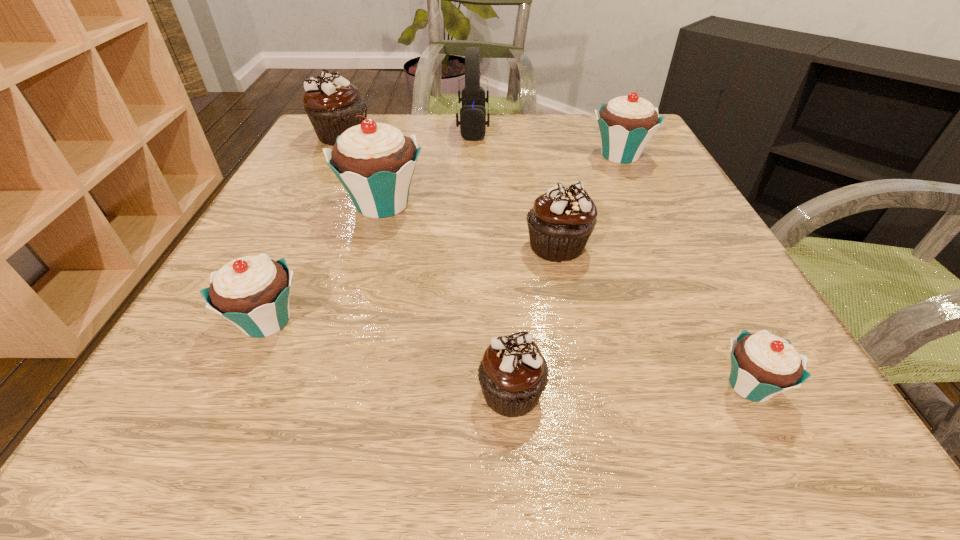
Find the location of a particular element. The height and width of the screenshot is (540, 960). object situated at the far left corner is located at coordinates (331, 103).

In order to click on object located in the far right corner section of the desktop in this screenshot , I will do `click(626, 124)`.

Locate an element on the screen. The image size is (960, 540). object that is positioned at the near right corner is located at coordinates (763, 365).

The width and height of the screenshot is (960, 540). Find the location of `free space at the far edge`. free space at the far edge is located at coordinates (511, 117).

Identify the location of vacant area at the near edge. The width and height of the screenshot is (960, 540). (425, 424).

The height and width of the screenshot is (540, 960). What are the coordinates of `free space at the left edge` in the screenshot? It's located at (333, 231).

This screenshot has width=960, height=540. What are the coordinates of `free space at the right edge of the desktop` in the screenshot? It's located at (617, 163).

Locate an element on the screen. vacant space at the near left corner is located at coordinates (225, 422).

I want to click on vacant point located between the second biggest teal cupcake and the smallest brown cupcake, so click(x=565, y=274).

Find the location of a particular element. The width and height of the screenshot is (960, 540). empty space that is in between the second farthest teal cupcake and the smallest teal cupcake is located at coordinates (566, 295).